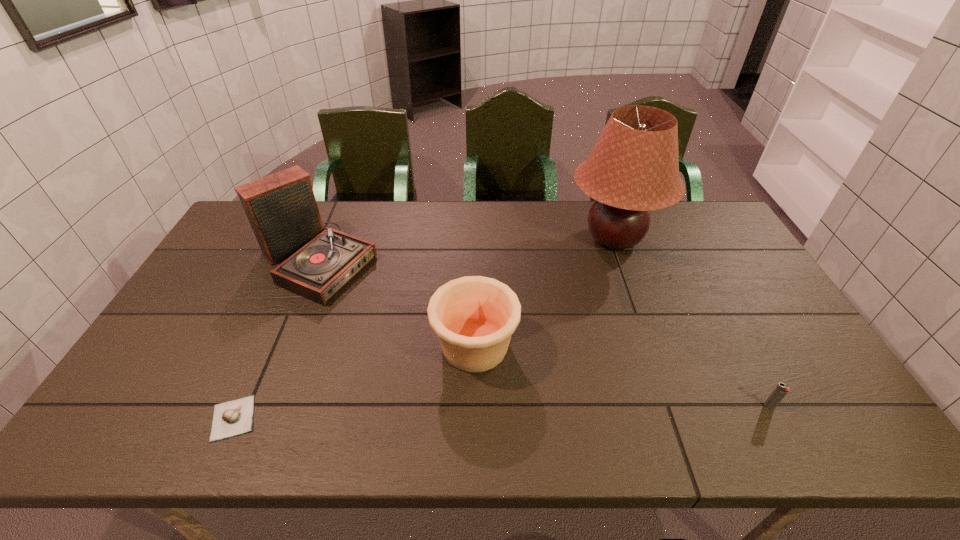
Locate an element on the screen. object that is at the far left corner is located at coordinates (281, 208).

Where is `free space at the far edge`? This screenshot has height=540, width=960. free space at the far edge is located at coordinates (420, 220).

In the image, there is a desktop. Where is `free space at the near edge`? free space at the near edge is located at coordinates (768, 413).

I want to click on vacant space at the left edge of the desktop, so click(180, 371).

In the image, there is a desktop. Identify the location of vacant space at the right edge. (688, 245).

The height and width of the screenshot is (540, 960). In the image, there is a desktop. Find the location of `free space at the far left corner`. free space at the far left corner is located at coordinates (240, 224).

In the image, there is a desktop. Identify the location of vacant space at the near left corner. The height and width of the screenshot is (540, 960). (166, 437).

I want to click on free space at the far right corner, so click(679, 213).

Find the location of a particular element. The image size is (960, 540). free space at the near right corner of the desktop is located at coordinates (821, 418).

Locate an element on the screen. This screenshot has width=960, height=540. free space between the rightmost object and the garlic is located at coordinates (501, 412).